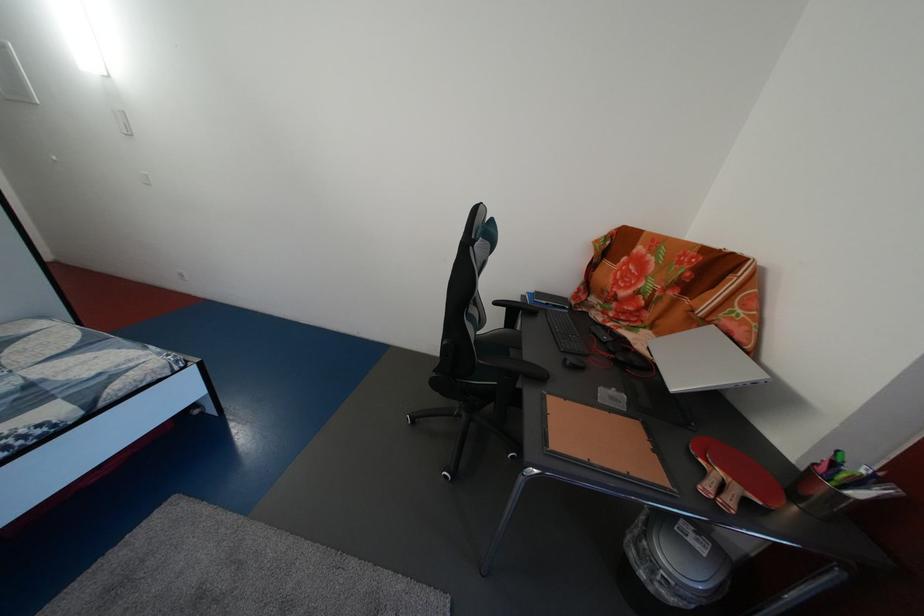
The width and height of the screenshot is (924, 616). What do you see at coordinates (512, 367) in the screenshot?
I see `the chair armrest` at bounding box center [512, 367].